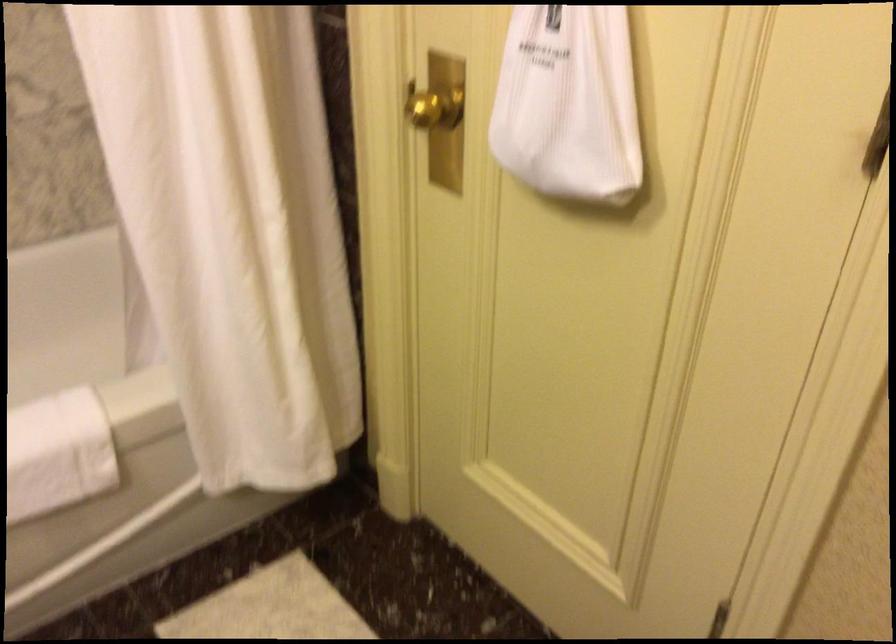
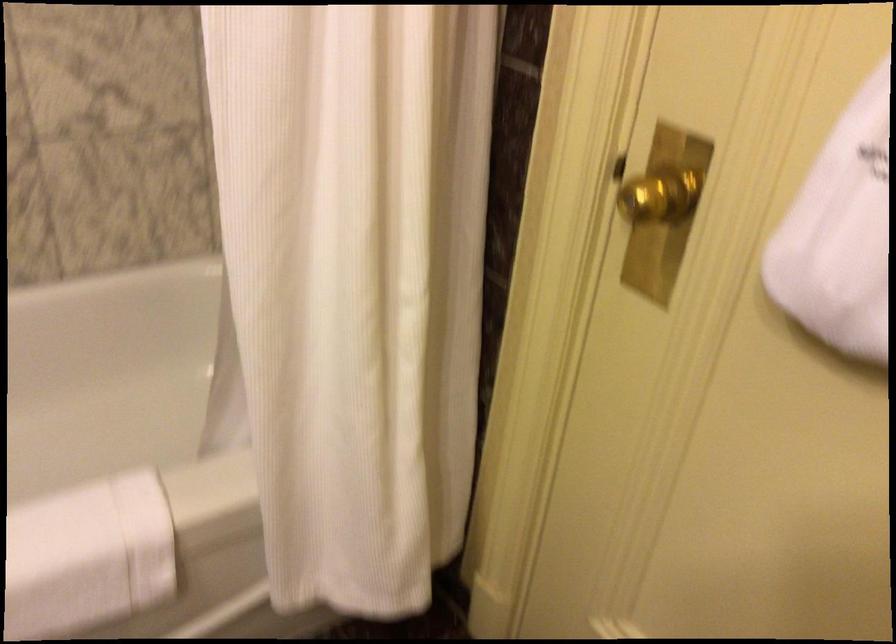
In the second image, find the point that corresponds to point 433,99 in the first image.

(657, 194)